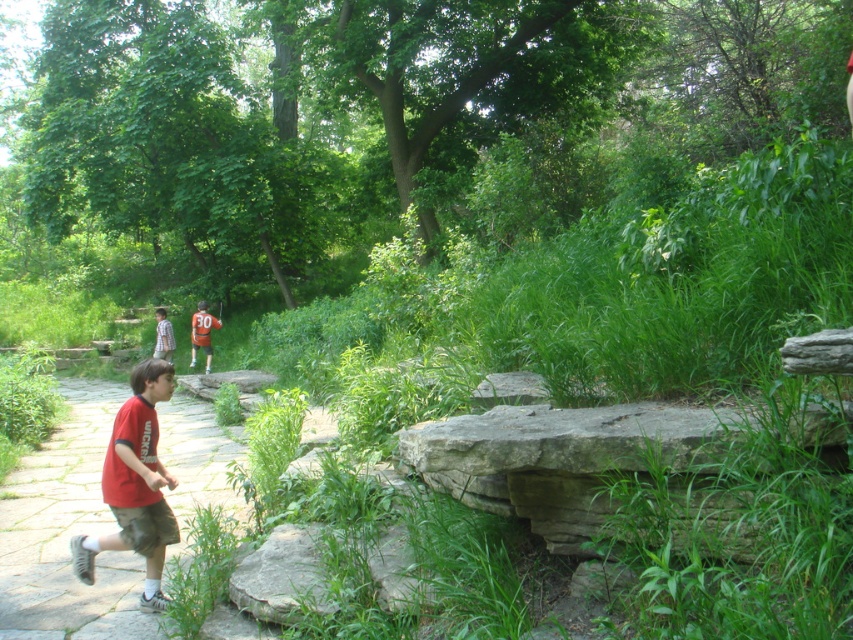
Question: Does red cotton shirt at left come behind orange jersey at center?

Choices:
 (A) no
 (B) yes

Answer: (A)

Question: Which point is farther to the camera?

Choices:
 (A) (183, 396)
 (B) (161, 369)
 (C) (659, 420)

Answer: (A)

Question: Does gray rough stone at lower right have a greater width compared to orange jersey at center?

Choices:
 (A) no
 (B) yes

Answer: (B)

Question: Which of the following is the farthest from the observer?

Choices:
 (A) orange jersey at center
 (B) gray rough stone at lower right
 (C) red fabric shirt at center

Answer: (A)

Question: Does orange jersey at center have a smaller size compared to plaid shirt at center?

Choices:
 (A) yes
 (B) no

Answer: (B)

Question: Which point is closer to the camera?

Choices:
 (A) (618, 456)
 (B) (151, 385)
 (C) (163, 326)

Answer: (A)